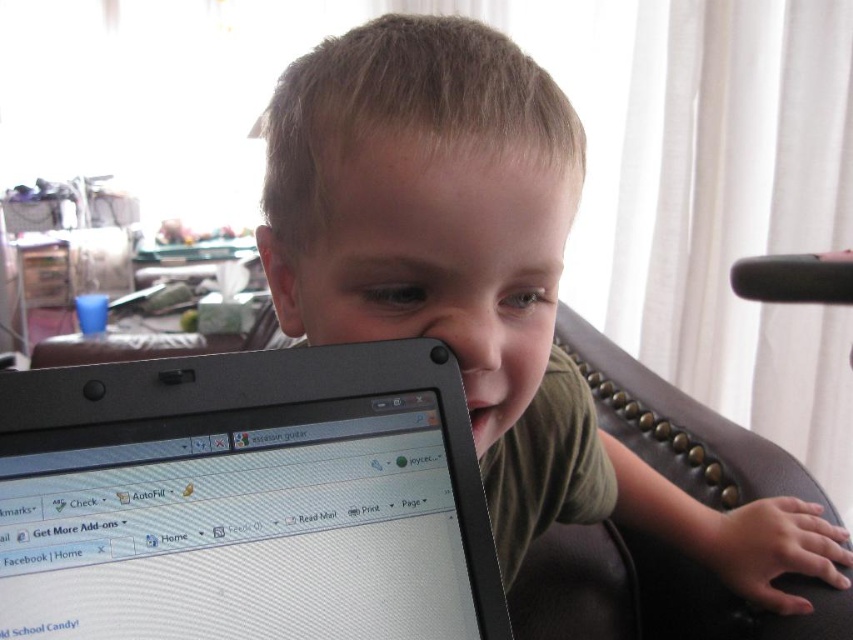
You are a delivery person who needs to place a small package on the desk in the image. The desk is located where the child is sitting. However, there is an object at point (x=245, y=499). Can you place the package there without moving the object?

The black plastic laptop at center is located at point (x=245, y=499). Since the desk where the child is sitting has the laptop in the way, you cannot place the package there without moving the laptop.

In the scene shown: You are a delivery person trying to place a package on the desk in the image. The package requires a minimum of 8 inches of space. Can you fit it between the black plastic laptop at center and the matte black laptop at center?

The black plastic laptop at center is only 7.01 inches from the matte black laptop at center, which is less than the required 8 inches. Therefore, the package cannot be placed between them.

You are a delivery person trying to place a package on the nearest laptop. Which laptop should you choose between the black plastic laptop at center and the matte black laptop at center?

The black plastic laptop at center is closer to the viewer than the matte black laptop at center, so you should place the package on the black plastic laptop at center.